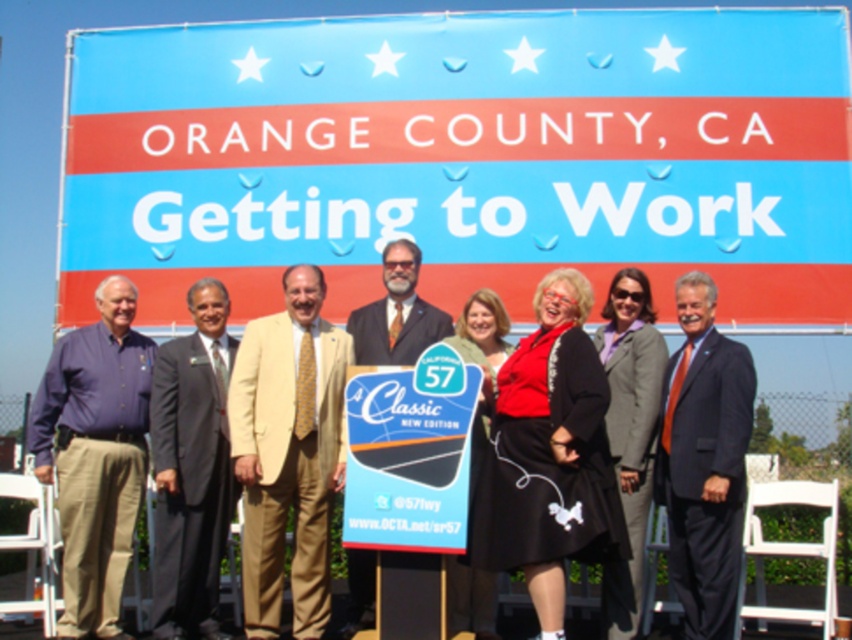
You are a photographer taking a picture of the blue fabric sign at upper center and the matte blue shirt at left. Which object is closer to your camera lens?

The blue fabric sign at upper center is closer to the camera lens because it is further to the viewer than the matte blue shirt at left.

You are standing in a park and see the blue fabric sign at upper center. If you want to read the text on the sign, do you need to walk closer to it?

The blue fabric sign at upper center is 48.90 meters away from the viewer, so yes, you need to walk closer to read the text on the blue fabric sign at upper center.

You are a photographer setting up for an event photo. You notice the blue fabric sign at upper center and the light beige suit at center in the scene. Based on their positions, which object is wider?

The blue fabric sign at upper center might be wider than light beige suit at center according to the description.